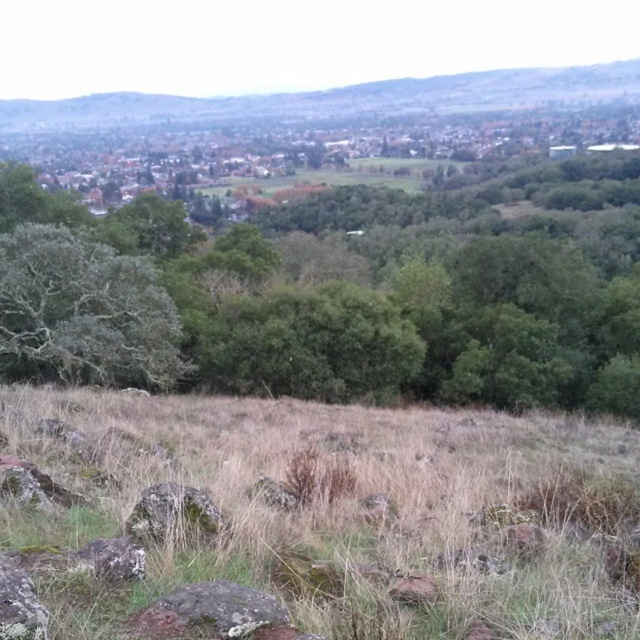
You are a hiker who wants to take a photo of the green grassy hillside at upper center and the mossy rock at lower center. Which object should you focus on first if you want to capture both in a single frame without moving your camera?

You should focus on the green grassy hillside at upper center first because it is bigger than the mossy rock at lower center, allowing it to be the main subject while the smaller mossy rock at lower center can be included in the frame as a secondary element.

You are an environmental scientist studying the landscape. You observe the green leafy tree at center and the green mossy rock at center. Based on their positions, which one is closer to the observer?

The green leafy tree at center is closer to the observer because the green mossy rock at center is positioned behind it.

You are standing at the base of the green grassy hillside at upper center. Which direction should you walk to reach the town in the background?

The town is located in the background behind the green grassy hillside at upper center. Since you are at the base of the hillside, you should walk forward towards the direction of the town in the background.